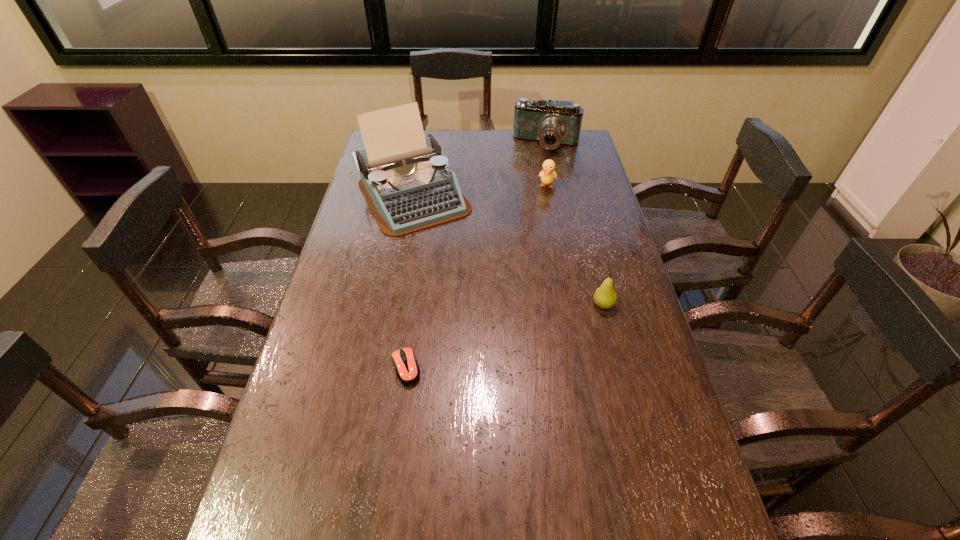
This screenshot has height=540, width=960. In order to click on pear positioned at the right edge in this screenshot , I will do [x=605, y=297].

Find the location of a particular element. camcorder positioned at the right edge is located at coordinates (551, 123).

The width and height of the screenshot is (960, 540). I want to click on object that is at the far right corner, so click(x=551, y=123).

Find the location of a particular element. free region at the far edge is located at coordinates (467, 153).

In the image, there is a desktop. Where is `vacant space at the near edge`? Image resolution: width=960 pixels, height=540 pixels. vacant space at the near edge is located at coordinates (611, 489).

Where is `vacant space at the left edge of the desktop`? This screenshot has height=540, width=960. vacant space at the left edge of the desktop is located at coordinates (374, 223).

Locate an element on the screen. The height and width of the screenshot is (540, 960). vacant space at the right edge of the desktop is located at coordinates [x=572, y=243].

Find the location of a particular element. This screenshot has width=960, height=540. unoccupied position between the pear and the nearest object is located at coordinates (504, 336).

The height and width of the screenshot is (540, 960). I want to click on free spot between the tallest object and the farthest object, so [480, 170].

Find the location of a particular element. The height and width of the screenshot is (540, 960). empty space that is in between the fourth farthest object and the tallest object is located at coordinates (508, 250).